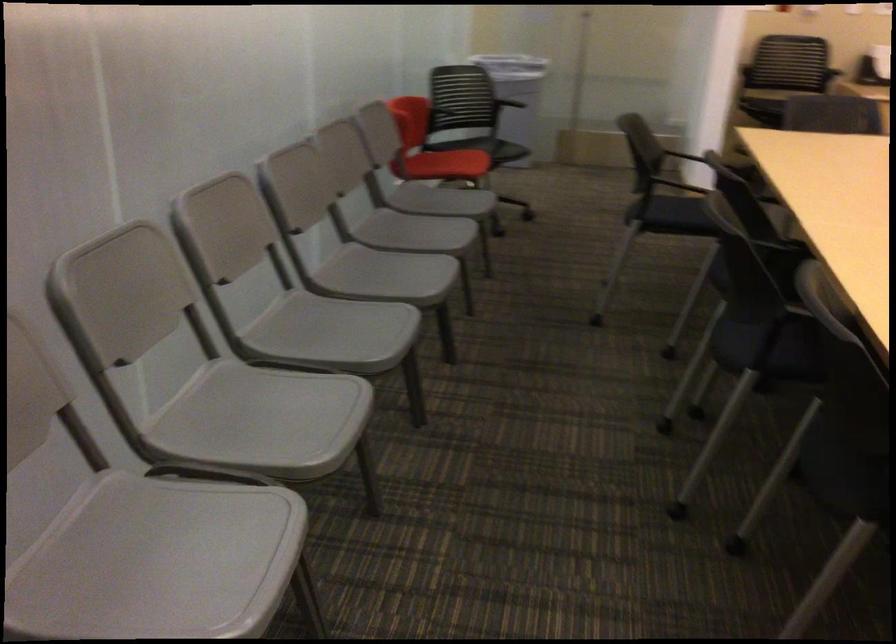
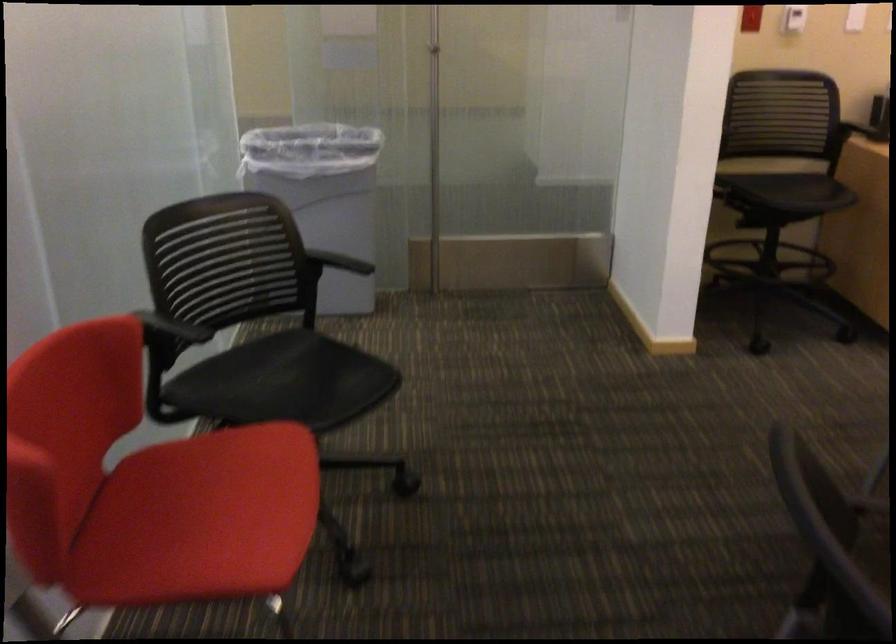
Locate, in the second image, the point that corresponds to (x=448, y=158) in the first image.

(200, 518)